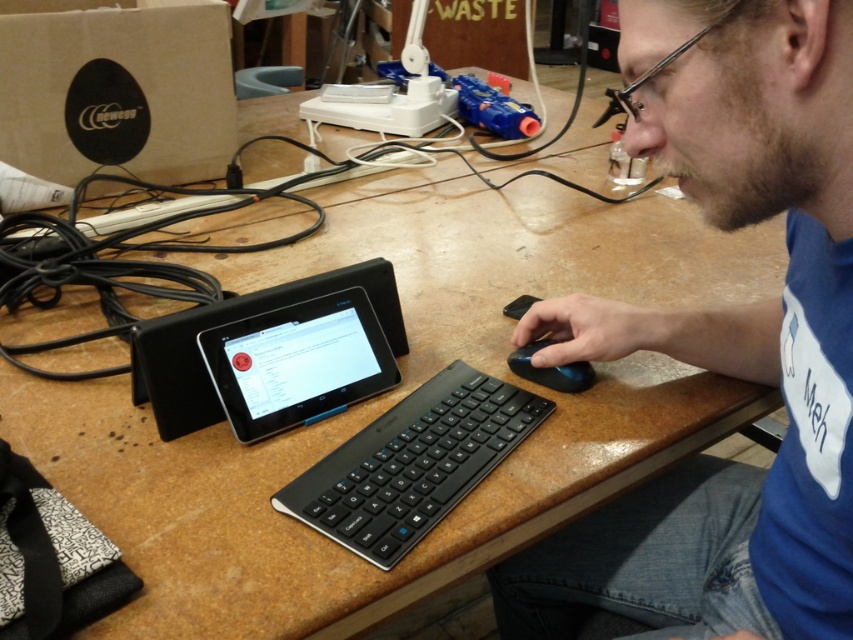
Between black glossy tablet at center and black matte mouse at lower right, which one appears on the left side from the viewer's perspective?

Positioned to the left is black glossy tablet at center.

Between point (360, 332) and point (556, 365), which one is positioned in front?

Point (556, 365) is in front.

This screenshot has width=853, height=640. Identify the location of black glossy tablet at center. (297, 362).

Does black matte keyboard at center come behind black glossy tablet at center?

No, it is in front of black glossy tablet at center.

Is black matte keyboard at center above black glossy tablet at center?

Actually, black matte keyboard at center is below black glossy tablet at center.

Is point (460, 394) positioned after point (354, 376)?

No.

Locate an element on the screen. black matte keyboard at center is located at coordinates (412, 464).

Does blue matte mouse at center come behind black matte mouse at lower right?

No, blue matte mouse at center is closer to the viewer.

You are a GUI agent. You are given a task and a screenshot of the screen. Output one action in this format:
    pyautogui.click(x=<x>, y=<y>)
    Task: Click on the blue matte mouse at center
    Image resolution: width=853 pixels, height=640 pixels.
    Given the screenshot: What is the action you would take?
    tap(724, 340)